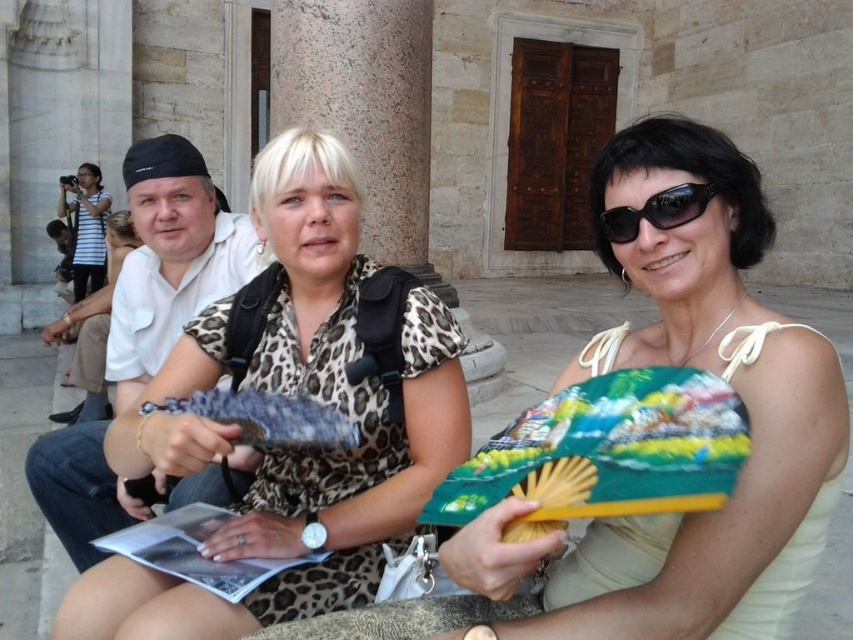
Question: Considering the real-world distances, which object is farthest from the striped cotton shirt at upper left?

Choices:
 (A) beige fabric fan at center
 (B) leopard print blouse at center

Answer: (A)

Question: Does beige fabric fan at center come in front of white cotton shirt at upper left?

Choices:
 (A) yes
 (B) no

Answer: (A)

Question: Can you confirm if white leopard print dress at center is smaller than striped cotton shirt at upper left?

Choices:
 (A) no
 (B) yes

Answer: (A)

Question: Does striped cotton shirt at upper left have a lesser width compared to black plastic sunglasses at upper right?

Choices:
 (A) yes
 (B) no

Answer: (B)

Question: Which object is positioned closest to the black plastic sunglasses at upper right?

Choices:
 (A) white cotton shirt at upper left
 (B) leopard print blouse at center
 (C) striped cotton shirt at upper left

Answer: (B)

Question: Which object is closer to the camera taking this photo?

Choices:
 (A) white cotton shirt at upper left
 (B) leopard print blouse at center

Answer: (B)